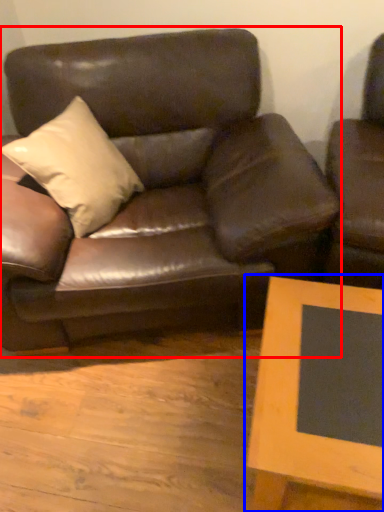
Question: Which object appears farthest to the camera in this image, studio couch (highlighted by a red box) or table (highlighted by a blue box)?

Choices:
 (A) studio couch
 (B) table

Answer: (A)